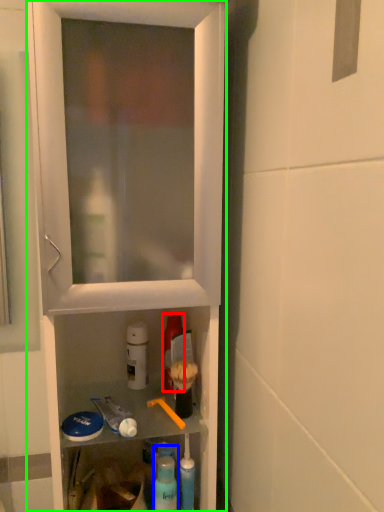
Question: Estimate the real-world distances between objects in this image. Which object is farther from mouthwash (highlighted by a red box), cleaning product (highlighted by a blue box) or cabinetry (highlighted by a green box)?

Choices:
 (A) cleaning product
 (B) cabinetry

Answer: (B)